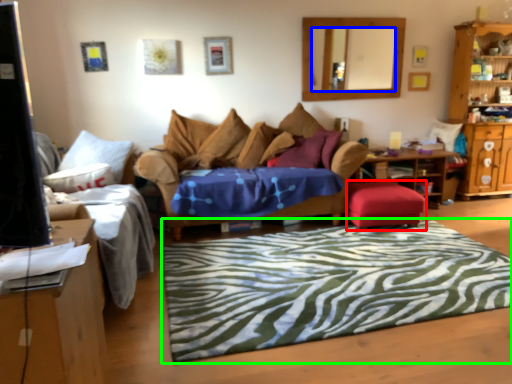
Question: Which object is positioned closest to stool (highlighted by a red box)? Select from mirror (highlighted by a blue box) and mat (highlighted by a green box).

Choices:
 (A) mirror
 (B) mat

Answer: (B)